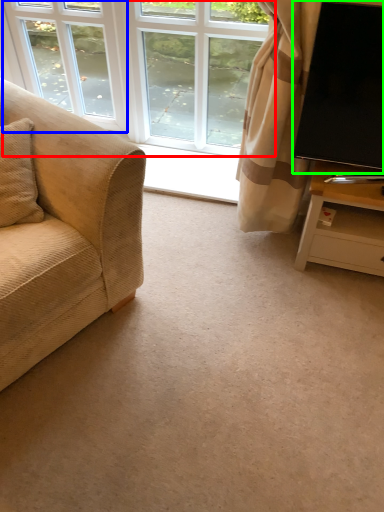
Question: Estimate the real-world distances between objects in this image. Which object is farther from window (highlighted by a red box), window (highlighted by a blue box) or television (highlighted by a green box)?

Choices:
 (A) window
 (B) television

Answer: (B)